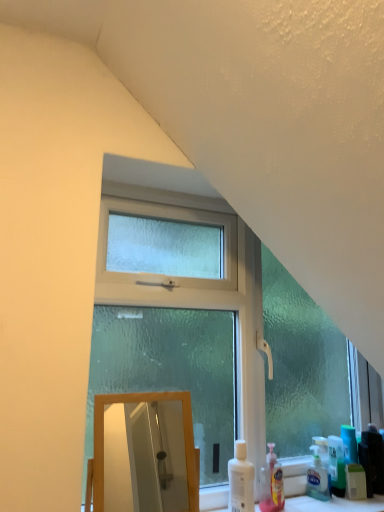
Question: Is frosted glass window at center in front of or behind white plastic bottle at lower right, arranged as the first cleaning product when viewed from the left, in the image?

Choices:
 (A) behind
 (B) front

Answer: (B)

Question: From their relative heights in the image, would you say frosted glass window at center is taller or shorter than white plastic bottle at lower right, arranged as the first cleaning product when viewed from the left?

Choices:
 (A) short
 (B) tall

Answer: (B)

Question: Estimate the real-world distances between objects in this image. Which object is farther from the wooden mirror at lower left?

Choices:
 (A) white plastic bottle at lower right, arranged as the first cleaning product when viewed from the left
 (B) frosted glass window at center
 (C) translucent plastic bottle at lower center, marked as the second cleaning product in a left-to-right arrangement

Answer: (C)

Question: Which object is positioned farthest from the translucent plastic bottle at lower center, marked as the second cleaning product in a left-to-right arrangement?

Choices:
 (A) wooden mirror at lower left
 (B) white plastic bottle at lower right, the 2th cleaning product when ordered from right to left
 (C) frosted glass window at center

Answer: (A)